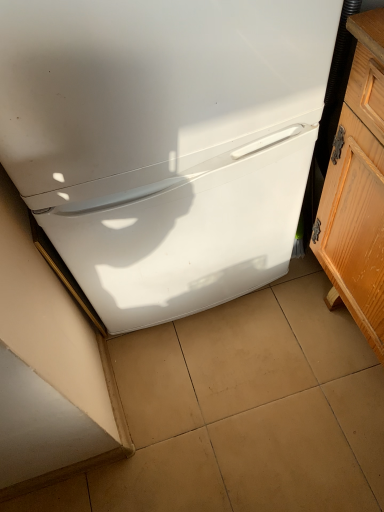
Question: Is wooden cabinet at right bigger than white glossy refrigerator at center?

Choices:
 (A) yes
 (B) no

Answer: (B)

Question: Would you say wooden cabinet at right contains white glossy refrigerator at center?

Choices:
 (A) no
 (B) yes

Answer: (A)

Question: Would you say wooden cabinet at right is outside white glossy refrigerator at center?

Choices:
 (A) no
 (B) yes

Answer: (B)

Question: Is wooden cabinet at right positioned before white glossy refrigerator at center?

Choices:
 (A) no
 (B) yes

Answer: (B)

Question: From the image's perspective, is wooden cabinet at right over white glossy refrigerator at center?

Choices:
 (A) yes
 (B) no

Answer: (B)

Question: Is wooden cabinet at right inside the boundaries of beige tile at center, or outside?

Choices:
 (A) inside
 (B) outside

Answer: (B)

Question: In the image, is wooden cabinet at right on the left side or the right side of beige tile at center?

Choices:
 (A) left
 (B) right

Answer: (B)

Question: Considering the positions of wooden cabinet at right and beige tile at center in the image, is wooden cabinet at right taller or shorter than beige tile at center?

Choices:
 (A) short
 (B) tall

Answer: (B)

Question: Is wooden cabinet at right bigger or smaller than beige tile at center?

Choices:
 (A) big
 (B) small

Answer: (A)

Question: Is beige tile at center inside the boundaries of wooden cabinet at right, or outside?

Choices:
 (A) outside
 (B) inside

Answer: (A)

Question: In terms of height, does beige tile at center look taller or shorter compared to wooden cabinet at right?

Choices:
 (A) short
 (B) tall

Answer: (A)

Question: From a real-world perspective, relative to wooden cabinet at right, is beige tile at center vertically above or below?

Choices:
 (A) above
 (B) below

Answer: (B)

Question: Is point (251, 394) closer or farther from the camera than point (367, 62)?

Choices:
 (A) closer
 (B) farther

Answer: (B)

Question: Does point (125, 82) appear closer or farther from the camera than point (324, 223)?

Choices:
 (A) farther
 (B) closer

Answer: (B)

Question: In terms of height, does white glossy refrigerator at center look taller or shorter compared to wooden cabinet at right?

Choices:
 (A) short
 (B) tall

Answer: (B)